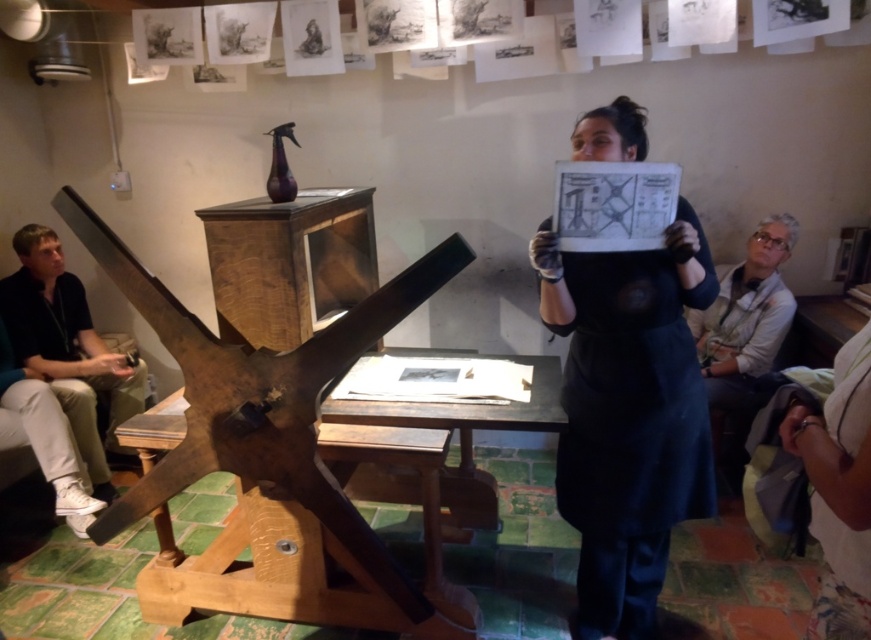
Does rusty wood easel at center have a smaller size compared to white shirt at right?

Actually, rusty wood easel at center might be larger than white shirt at right.

The width and height of the screenshot is (871, 640). In order to click on rusty wood easel at center in this screenshot , I will do `click(267, 449)`.

Find the location of a particular element. rusty wood easel at center is located at coordinates (267, 449).

Between point (561, 268) and point (44, 337), which one is positioned in front?

Point (561, 268) is more forward.

Does black matte dress at center appear under black cotton shirt at left?

Yes, black matte dress at center is below black cotton shirt at left.

Locate an element on the screen. black matte dress at center is located at coordinates (628, 413).

Who is shorter, rusty wood easel at center or black cotton shirt at left?

black cotton shirt at left is shorter.

What do you see at coordinates (267, 449) in the screenshot? I see `rusty wood easel at center` at bounding box center [267, 449].

Locate an element on the screen. The height and width of the screenshot is (640, 871). rusty wood easel at center is located at coordinates (267, 449).